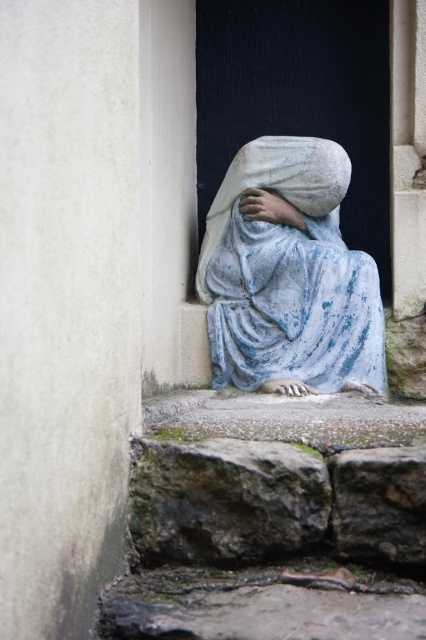
Describe the element at coordinates (273, 520) in the screenshot. I see `rough stone stairs at lower left` at that location.

The image size is (426, 640). What do you see at coordinates (273, 520) in the screenshot?
I see `rough stone stairs at lower left` at bounding box center [273, 520].

The image size is (426, 640). Find the location of `rough stone stairs at lower left`. rough stone stairs at lower left is located at coordinates (273, 520).